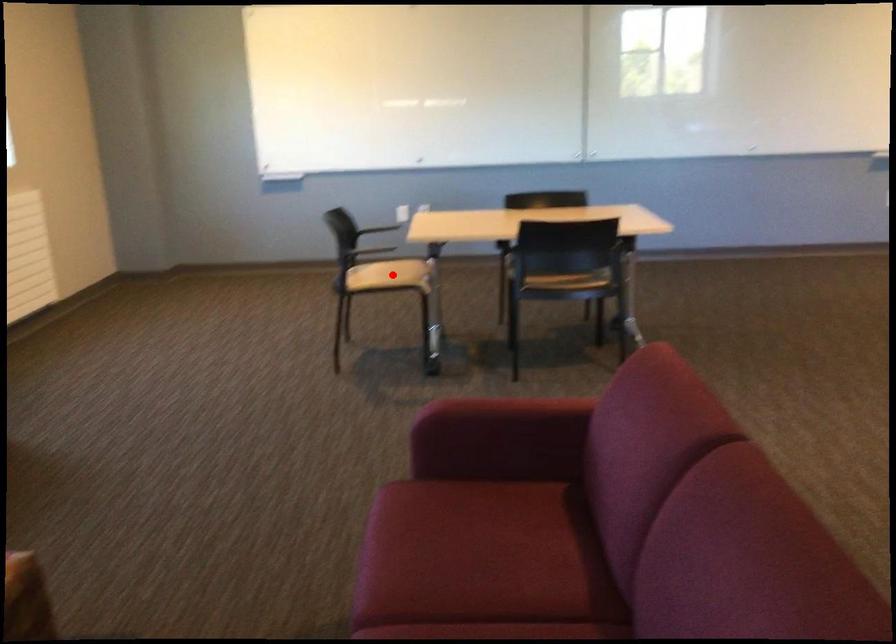
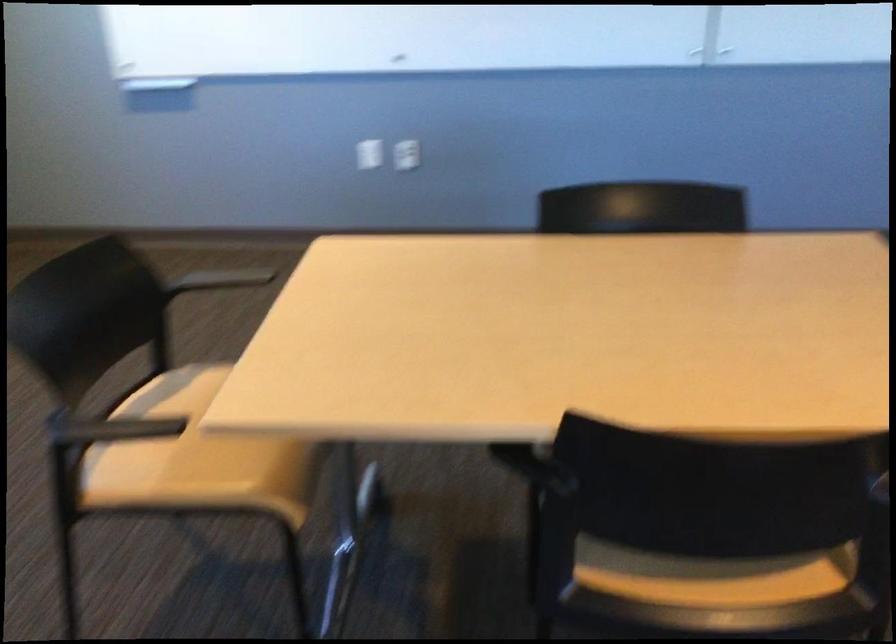
Find the pixel in the second image that matches the highlighted location in the first image.

(194, 458)